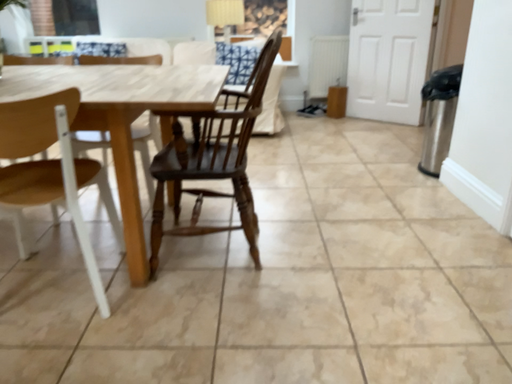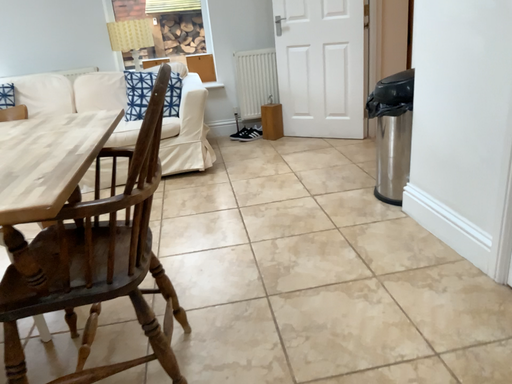
Question: Which way did the camera rotate in the video?

Choices:
 (A) rotated right
 (B) rotated left

Answer: (A)